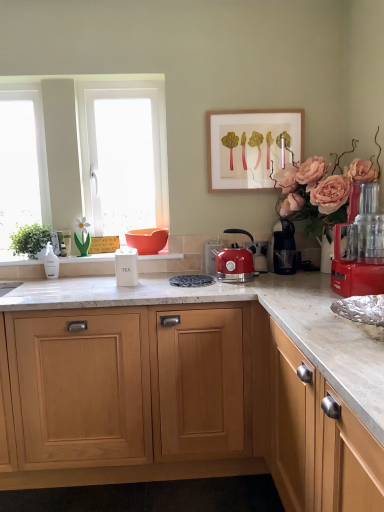
Where is `free point to the right of white glossy bottle at left, acting as the fifth kitchen appliance starting from the front`? Image resolution: width=384 pixels, height=512 pixels. free point to the right of white glossy bottle at left, acting as the fifth kitchen appliance starting from the front is located at coordinates (76, 280).